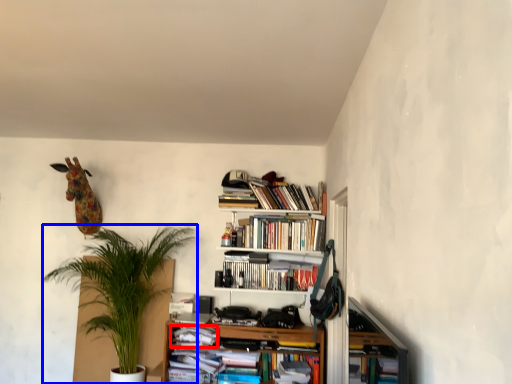
Question: Which object is further to the camera taking this photo, book (highlighted by a red box) or houseplant (highlighted by a blue box)?

Choices:
 (A) book
 (B) houseplant

Answer: (A)